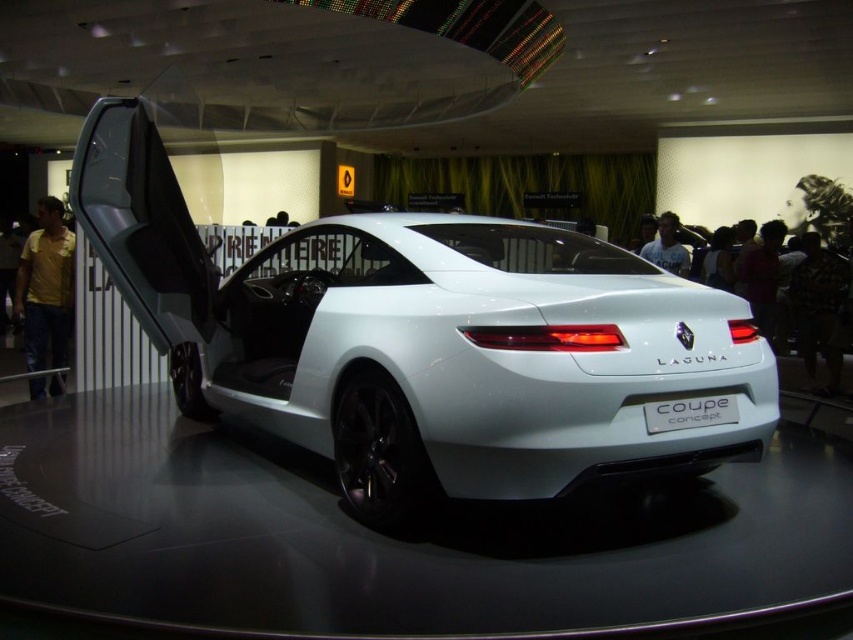
You are standing in an auto show and see the white matte coupe at center and the yellow cotton shirt at left. Which object is nearer to you?

The white matte coupe at center is closer to the viewer than the yellow cotton shirt at left.

You are at an auto show and see the Renault Laguna Coupe Concept car. There is a yellow cotton shirt at left and a dark hair at upper right in the image. Which object is positioned more to the left?

The yellow cotton shirt at left is positioned more to the left than the dark hair at upper right.